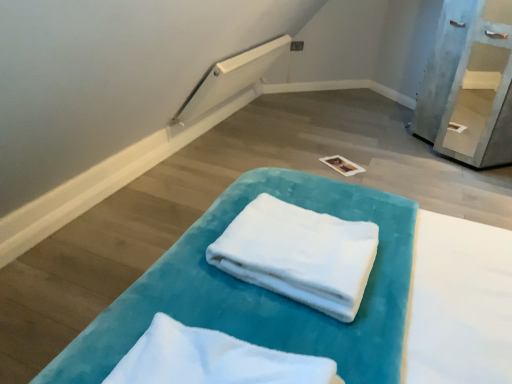
Question: From a real-world perspective, does white soft towel at center, which appears as the 2th cloth when viewed from the back, stand above white soft towel at center, the second cloth in the front-to-back sequence?

Choices:
 (A) no
 (B) yes

Answer: (B)

Question: From the image's perspective, is white soft towel at center, which is counted as the 1th cloth, starting from the front, on white soft towel at center, the second cloth in the front-to-back sequence?

Choices:
 (A) no
 (B) yes

Answer: (A)

Question: From a real-world perspective, is white soft towel at center, which is counted as the 1th cloth, starting from the front, positioned under white soft towel at center, the second cloth in the front-to-back sequence, based on gravity?

Choices:
 (A) yes
 (B) no

Answer: (B)

Question: From the image's perspective, is white soft towel at center, which is counted as the 1th cloth, starting from the front, under white soft towel at center, placed as the first cloth when sorted from back to front?

Choices:
 (A) yes
 (B) no

Answer: (A)

Question: Is the surface of white soft towel at center, which is counted as the 1th cloth, starting from the front, in direct contact with white soft towel at center, the second cloth in the front-to-back sequence?

Choices:
 (A) no
 (B) yes

Answer: (A)

Question: From the image's perspective, is light blue painted wood shelf at upper right positioned above or below white soft towel at center, which appears as the 2th cloth when viewed from the back?

Choices:
 (A) above
 (B) below

Answer: (A)

Question: Does point (502, 56) appear closer or farther from the camera than point (112, 372)?

Choices:
 (A) farther
 (B) closer

Answer: (A)

Question: Considering the positions of light blue painted wood shelf at upper right and white soft towel at center, which appears as the 2th cloth when viewed from the back, in the image, is light blue painted wood shelf at upper right wider or thinner than white soft towel at center, which appears as the 2th cloth when viewed from the back,?

Choices:
 (A) thin
 (B) wide

Answer: (B)

Question: Considering the positions of light blue painted wood shelf at upper right and white soft towel at center, which appears as the 2th cloth when viewed from the back, in the image, is light blue painted wood shelf at upper right taller or shorter than white soft towel at center, which appears as the 2th cloth when viewed from the back,?

Choices:
 (A) tall
 (B) short

Answer: (A)

Question: Considering the positions of velvet teal towel at center and white soft towel at center, which is counted as the 1th cloth, starting from the front, in the image, is velvet teal towel at center wider or thinner than white soft towel at center, which is counted as the 1th cloth, starting from the front,?

Choices:
 (A) thin
 (B) wide

Answer: (B)

Question: In terms of height, does velvet teal towel at center look taller or shorter compared to white soft towel at center, which is counted as the 1th cloth, starting from the front?

Choices:
 (A) short
 (B) tall

Answer: (A)

Question: From the image's perspective, is velvet teal towel at center positioned above or below white soft towel at center, which appears as the 2th cloth when viewed from the back?

Choices:
 (A) above
 (B) below

Answer: (A)

Question: Which is correct: velvet teal towel at center is inside white soft towel at center, which is counted as the 1th cloth, starting from the front, or outside of it?

Choices:
 (A) outside
 (B) inside

Answer: (A)

Question: Is white soft towel at center, placed as the first cloth when sorted from back to front, taller or shorter than white soft towel at center, which is counted as the 1th cloth, starting from the front?

Choices:
 (A) tall
 (B) short

Answer: (B)

Question: Looking at the image, does white soft towel at center, the second cloth in the front-to-back sequence, seem bigger or smaller compared to white soft towel at center, which is counted as the 1th cloth, starting from the front?

Choices:
 (A) small
 (B) big

Answer: (B)